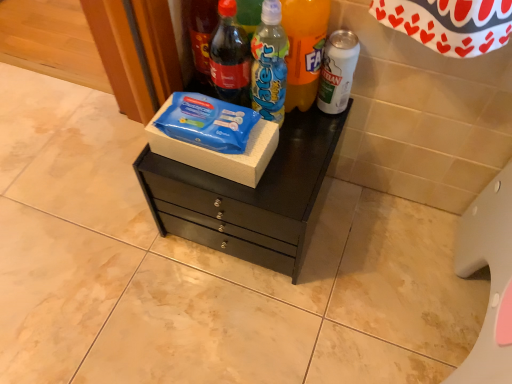
Find the location of a particular element. vacant area that lies in front of white matte can at right, the first bottle from the right is located at coordinates (303, 162).